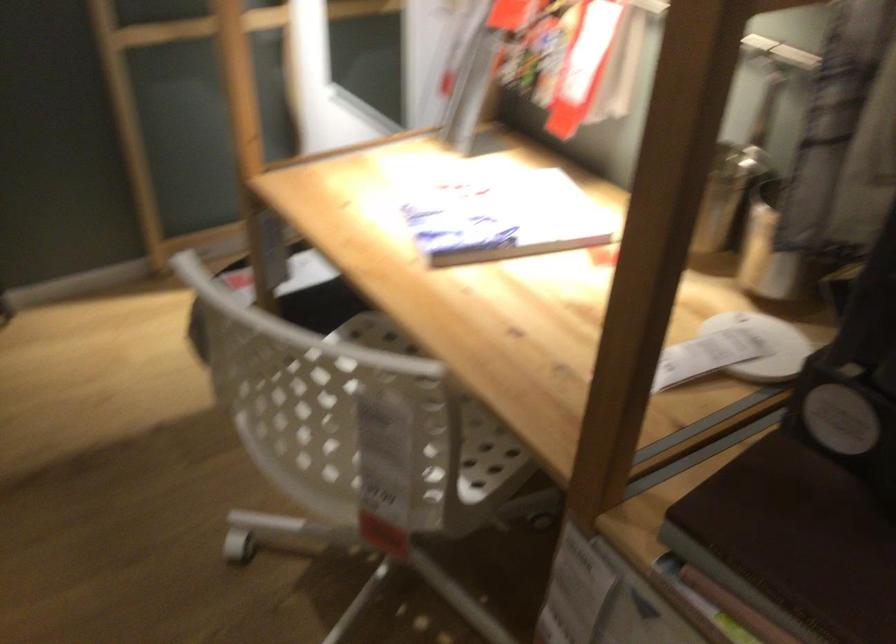
Find the location of `white chair sitting surface`. white chair sitting surface is located at coordinates coord(371,418).